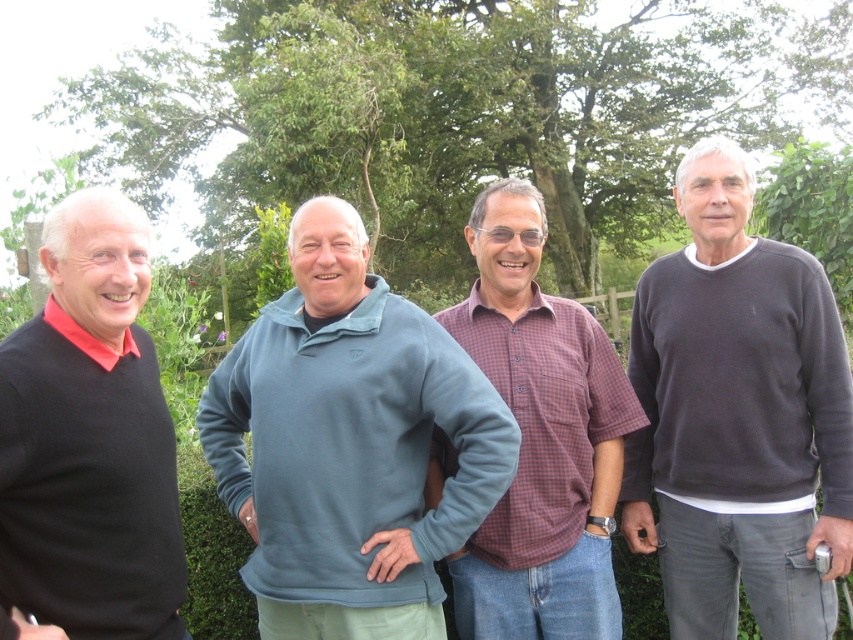
Can you confirm if teal fleece at center is positioned above plaid cotton shirt at center?

No, teal fleece at center is not above plaid cotton shirt at center.

Who is more distant from viewer, (403, 340) or (500, 388)?

The point (500, 388) is behind.

This screenshot has width=853, height=640. I want to click on teal fleece at center, so click(349, 444).

Who is higher up, teal fleece at center or dark gray sweater at right?

dark gray sweater at right is above.

The width and height of the screenshot is (853, 640). In order to click on teal fleece at center in this screenshot , I will do `click(349, 444)`.

Can you confirm if dark gray sweater at right is positioned to the left of plaid cotton shirt at center?

No, dark gray sweater at right is not to the left of plaid cotton shirt at center.

Which is more to the right, dark gray sweater at right or plaid cotton shirt at center?

Positioned to the right is dark gray sweater at right.

This screenshot has width=853, height=640. In order to click on dark gray sweater at right in this screenshot , I will do `click(738, 417)`.